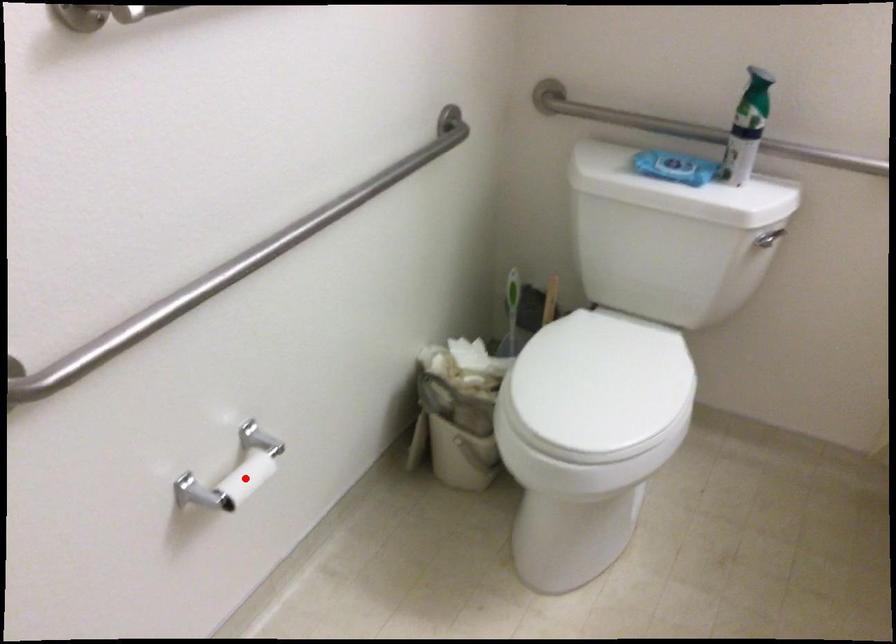
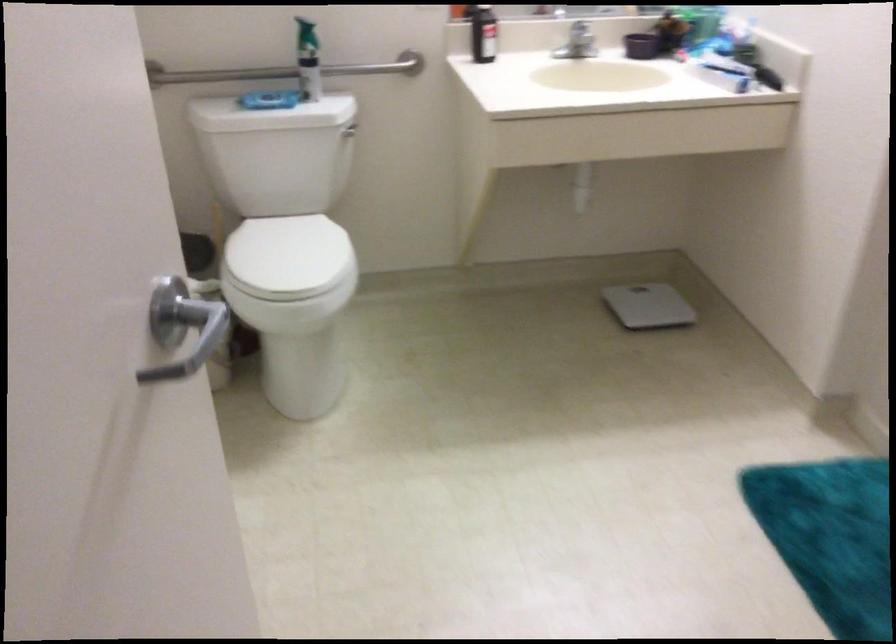
Question: I am providing you with two images of the same scene from different viewpoints. A red point is marked on the first image. Can you still see the location of the red point in image 2?

Choices:
 (A) Yes
 (B) No

Answer: (B)